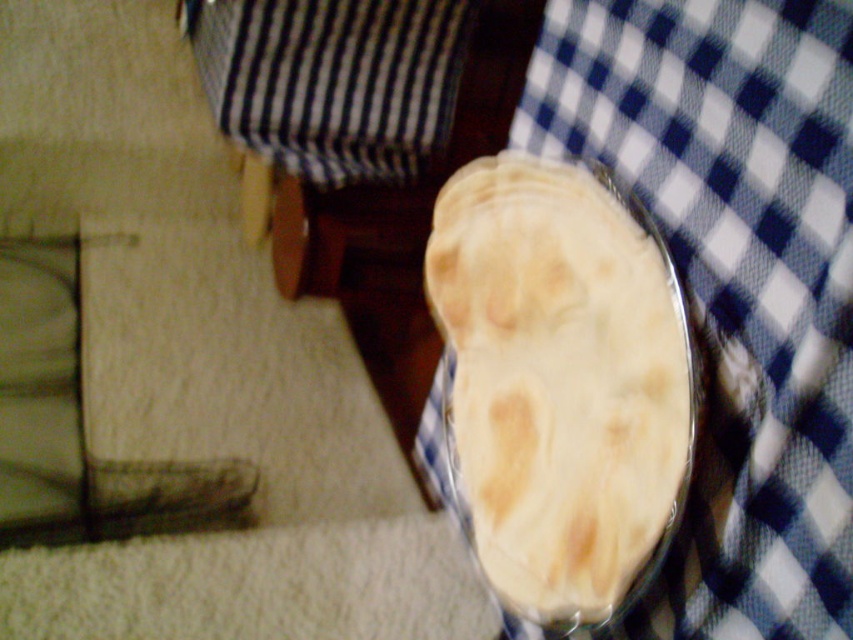
Question: Which of the following is the closest to the observer?

Choices:
 (A) blue checkered tablecloth at upper right
 (B) white matte flatbread at center
 (C) black striped fabric at upper center

Answer: (A)

Question: Is blue checkered tablecloth at upper right smaller than white matte flatbread at center?

Choices:
 (A) yes
 (B) no

Answer: (B)

Question: From the image, what is the correct spatial relationship of black striped fabric at upper center in relation to white matte flatbread at center?

Choices:
 (A) left
 (B) right

Answer: (A)

Question: Which of the following is the farthest from the observer?

Choices:
 (A) (512, 106)
 (B) (612, 604)

Answer: (A)

Question: Which of these objects is positioned closest to the black striped fabric at upper center?

Choices:
 (A) blue checkered tablecloth at upper right
 (B) white matte flatbread at center

Answer: (B)

Question: Considering the relative positions of blue checkered tablecloth at upper right and black striped fabric at upper center in the image provided, where is blue checkered tablecloth at upper right located with respect to black striped fabric at upper center?

Choices:
 (A) left
 (B) right

Answer: (B)